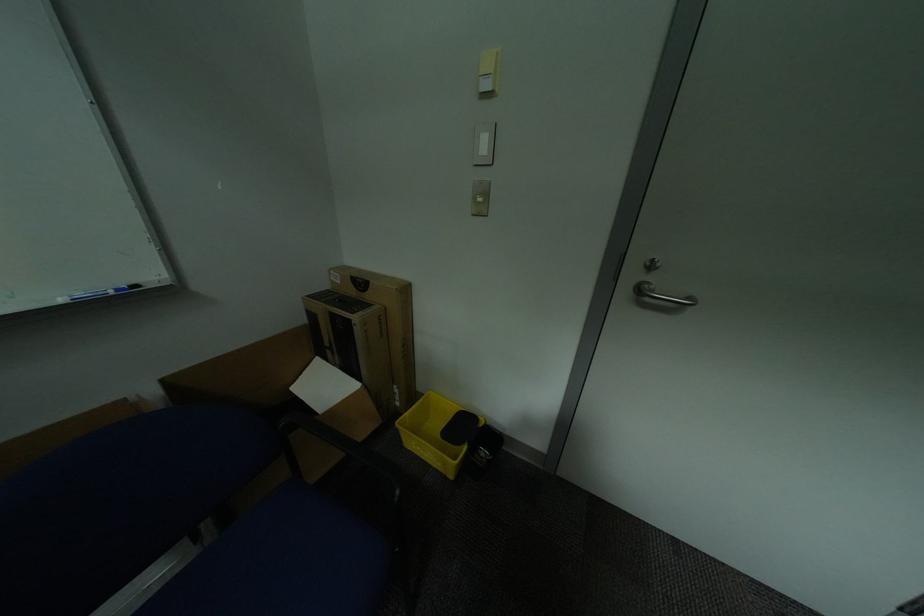
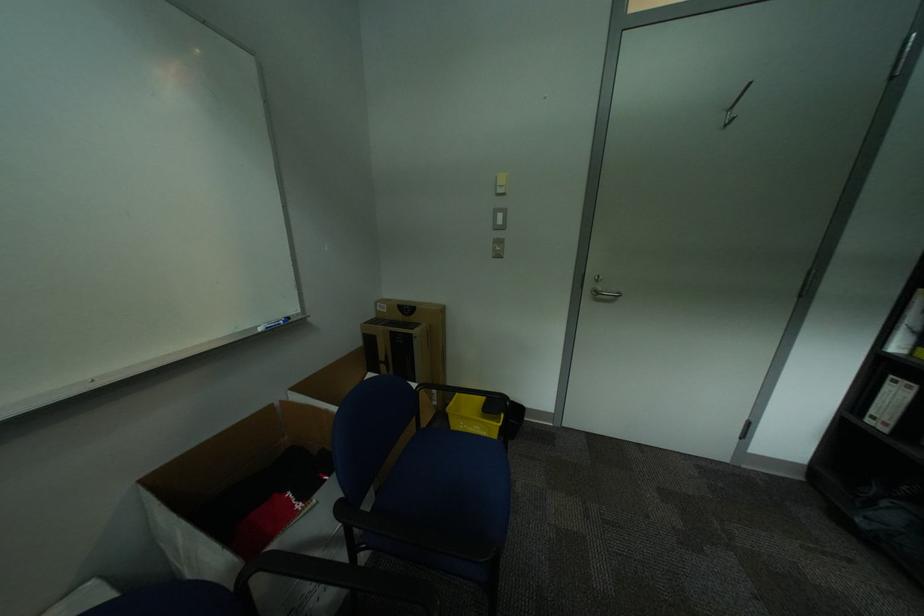
Find the pixel in the second image that matches the point at 408,405 in the first image.

(445, 403)